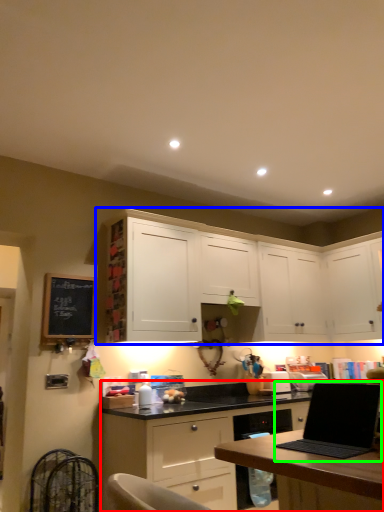
Question: Which is farther away from cabinetry (highlighted by a red box)? cabinetry (highlighted by a blue box) or laptop (highlighted by a green box)?

Choices:
 (A) cabinetry
 (B) laptop

Answer: (B)